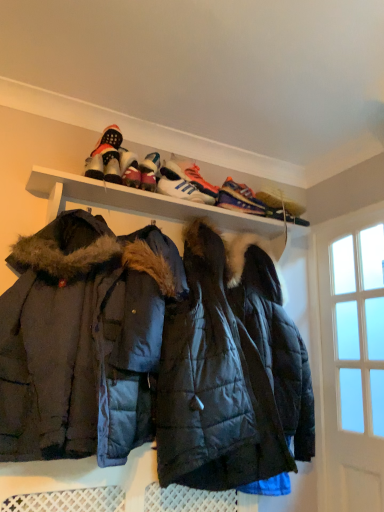
Question: From a real-world perspective, is white leather sneakers at upper center, the 2th footwear viewed from the left, positioned above or below white matte shelf at upper center?

Choices:
 (A) below
 (B) above

Answer: (B)

Question: Choose the correct answer: Is white leather sneakers at upper center, the 2th footwear viewed from the left, inside white matte shelf at upper center or outside it?

Choices:
 (A) inside
 (B) outside

Answer: (B)

Question: Based on their relative distances, which object is nearer to the white matte shelf at upper center?

Choices:
 (A) clear glass door at right
 (B) blue suede sneaker at upper center, the second footwear from the right
 (C) white leather sneakers at upper center, arranged as the fourth footwear when viewed from the right
 (D) dark blue quilted jacket at center
 (E) white leather sneakers at upper center, the third footwear positioned from the right

Answer: (E)

Question: Estimate the real-world distances between objects in this image. Which object is farther from the dark blue quilted jacket at center?

Choices:
 (A) clear glass door at right
 (B) white leather sneakers at upper center, the 3th footwear when ordered from left to right
 (C) white leather sneakers at upper center, arranged as the fourth footwear when viewed from the right
 (D) shiny black sneakers at upper center, marked as the 1th footwear in a right-to-left arrangement
 (E) blue suede sneaker at upper center, the second footwear from the right

Answer: (A)